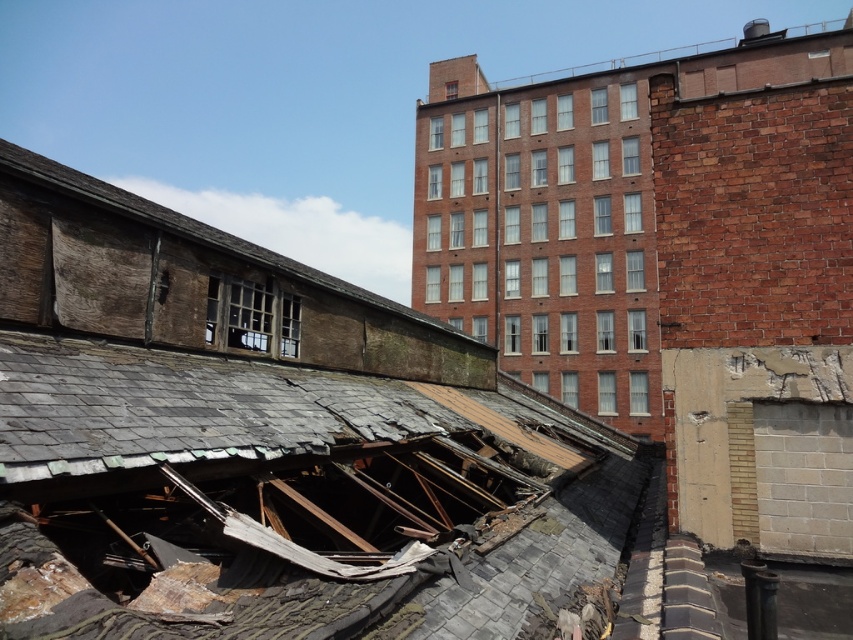
Who is lower down, weathered wood at upper left or smooth brick roof at upper center?

Positioned lower is weathered wood at upper left.

Between point (310, 275) and point (724, 44), which one is positioned behind?

The point (724, 44) is more distant.

Measure the distance between weathered wood at upper left and camera.

weathered wood at upper left is 23.58 feet from camera.

What are the coordinates of `weathered wood at upper left` in the screenshot? It's located at (199, 230).